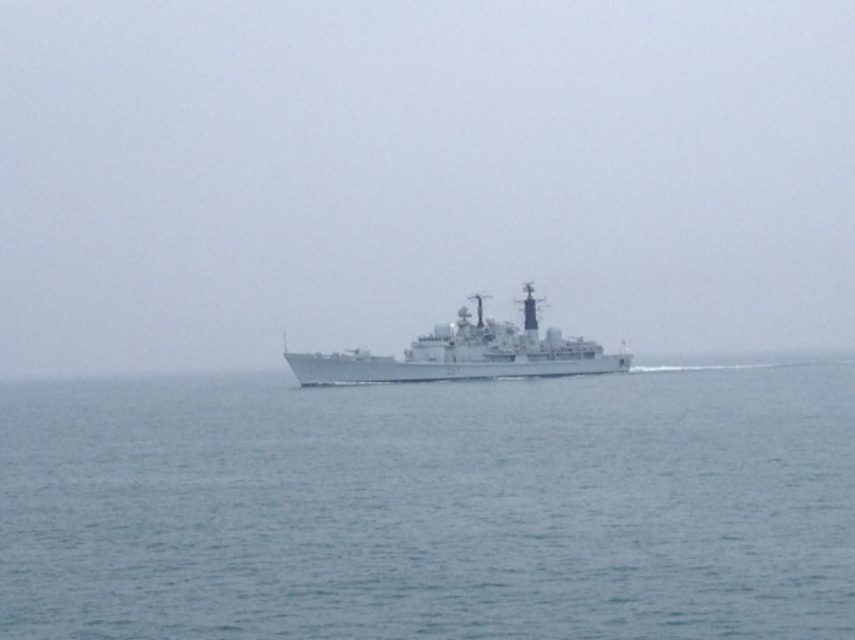
You are an observer on a nearby island watching the gray metallic ship at center sail away. You notice the blue water at center. Which object will appear smaller as the ship moves further away from you?

The gray metallic ship at center will appear smaller as it moves further away from you because it is behind the blue water at center, which remains at a constant distance.

You are a sailor on the naval ship and need to estimate the space between the ship and the nearest land. Since there are no landmarks, you decide to compare the width of the blue water at center with the gray metallic ship at center. Which one is wider?

The blue water at center is wider than the gray metallic ship at center according to the description.

You are an observer on the naval ship depicted. You notice two points marked on the ship. The first point is at coordinates point (624,532) and the second point is at point (587,342). Which of these two points is nearer to you?

Point (624,532) is closer to the viewer than point (587,342), so the first point is nearer to you.